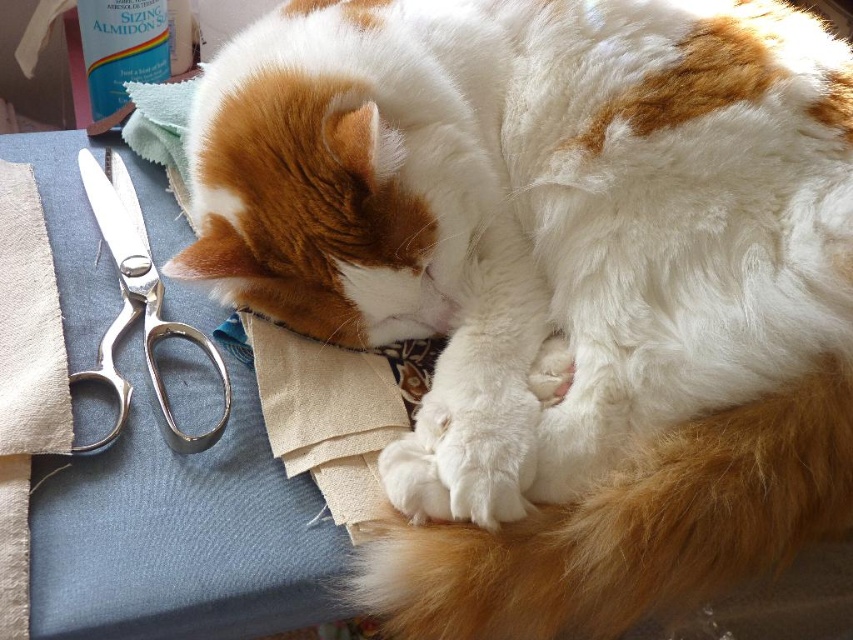
Does point (525, 628) lie in front of point (117, 328)?

Yes.

This screenshot has width=853, height=640. I want to click on white fur at lower right, so click(631, 529).